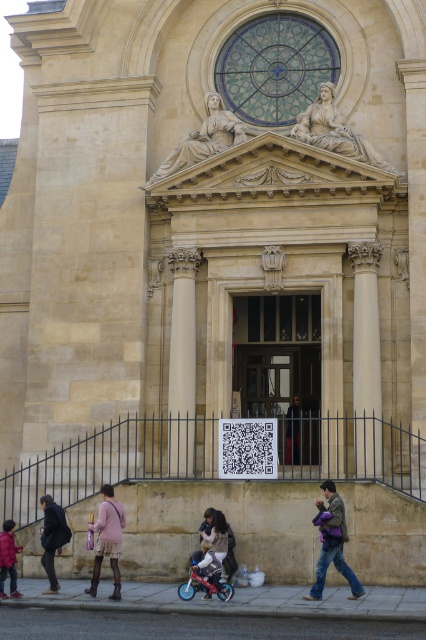
You are standing in front of the classical building and want to place a small potted plant between the jeans at lower right and the matte black jacket at lower center. Which object should the plant be closer to if it needs to be placed closer to the shorter one?

The jeans at lower right is shorter than the matte black jacket at lower center, so the plant should be placed closer to the jeans at lower right.

You are a photographer setting up equipment in front of the classical building. You have two items to place on the ground near the base of the building. The jeans at lower right and the matte black jacket at lower center. Which item takes up more space on the ground?

The matte black jacket at lower center takes up more space on the ground than the jeans at lower right, as the jeans at lower right occupies less space than matte black jacket at lower center.